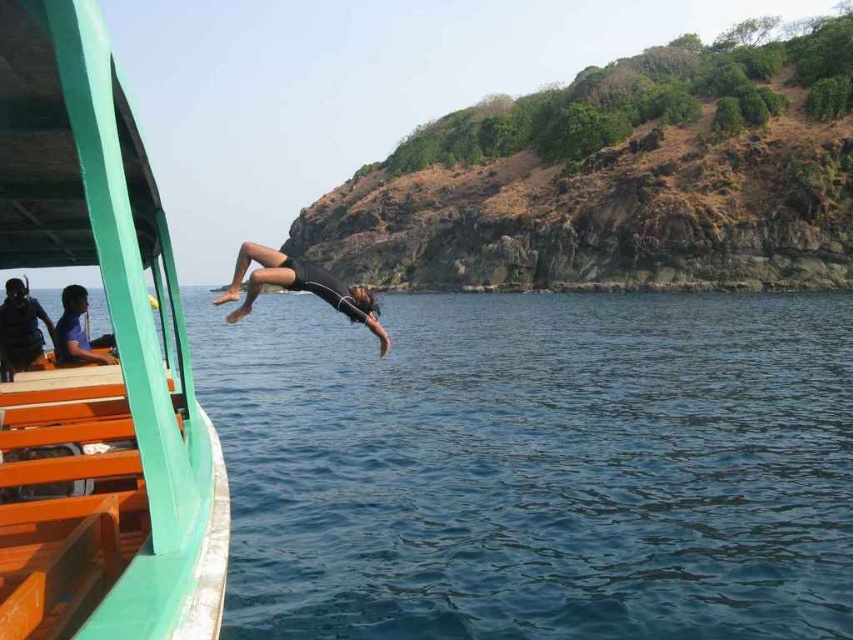
Which is behind, point (0, 604) or point (7, 305)?

The point (7, 305) is behind.

Is point (126, 355) less distant than point (9, 339)?

Yes, it is in front of point (9, 339).

This screenshot has height=640, width=853. What are the coordinates of `green painted wood boat at left` in the screenshot? It's located at (100, 368).

Which is below, green painted wood boat at left or matte black shorts at left?

Positioned lower is matte black shorts at left.

Is green painted wood boat at left wider than matte black shorts at left?

No, green painted wood boat at left is not wider than matte black shorts at left.

What do you see at coordinates (100, 368) in the screenshot? I see `green painted wood boat at left` at bounding box center [100, 368].

Identify the location of green painted wood boat at left. [x=100, y=368].

Is the position of deep blue water at center more distant than that of green rocky cliff at upper right?

No, deep blue water at center is in front of green rocky cliff at upper right.

Is point (785, 509) closer to camera compared to point (297, 225)?

That is True.

Where is `deep blue water at center`? The image size is (853, 640). deep blue water at center is located at coordinates (537, 467).